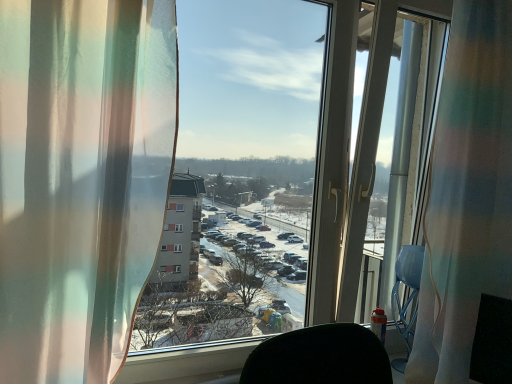
Question: Is there a large distance between translucent fabric curtain at right, which is the second curtain from front to back, and translucent sheer curtain at left, the second curtain viewed from the right?

Choices:
 (A) no
 (B) yes

Answer: (A)

Question: From a real-world perspective, does translucent fabric curtain at right, which is the second curtain from front to back, stand above translucent sheer curtain at left, the second curtain viewed from the right?

Choices:
 (A) yes
 (B) no

Answer: (A)

Question: Considering the relative sizes of translucent fabric curtain at right, positioned as the 2th curtain in left-to-right order, and translucent sheer curtain at left, arranged as the 2th curtain when viewed from the back, in the image provided, is translucent fabric curtain at right, positioned as the 2th curtain in left-to-right order, wider than translucent sheer curtain at left, arranged as the 2th curtain when viewed from the back,?

Choices:
 (A) yes
 (B) no

Answer: (B)

Question: From a real-world perspective, is translucent fabric curtain at right, which ranks as the first curtain in back-to-front order, located beneath translucent sheer curtain at left, the first curtain viewed from the left?

Choices:
 (A) yes
 (B) no

Answer: (B)

Question: Is translucent fabric curtain at right, arranged as the first curtain when viewed from the right, in contact with translucent sheer curtain at left, the second curtain viewed from the right?

Choices:
 (A) no
 (B) yes

Answer: (A)

Question: Is translucent fabric curtain at right, which ranks as the first curtain in back-to-front order, not inside translucent sheer curtain at left, the second curtain viewed from the right?

Choices:
 (A) yes
 (B) no

Answer: (A)

Question: Is translucent sheer curtain at left, the first curtain viewed from the left, at the right side of translucent fabric curtain at right, positioned as the 2th curtain in left-to-right order?

Choices:
 (A) yes
 (B) no

Answer: (B)

Question: Is translucent sheer curtain at left, the second curtain viewed from the right, taller than translucent fabric curtain at right, which is the second curtain from front to back?

Choices:
 (A) no
 (B) yes

Answer: (A)

Question: From the image's perspective, is translucent sheer curtain at left, the second curtain viewed from the right, under translucent fabric curtain at right, arranged as the first curtain when viewed from the right?

Choices:
 (A) yes
 (B) no

Answer: (A)

Question: Is translucent sheer curtain at left, arranged as the 2th curtain when viewed from the back, bigger than translucent fabric curtain at right, which is the second curtain from front to back?

Choices:
 (A) yes
 (B) no

Answer: (B)

Question: Is translucent sheer curtain at left, which is the first curtain from front to back, with translucent fabric curtain at right, positioned as the 2th curtain in left-to-right order?

Choices:
 (A) yes
 (B) no

Answer: (B)

Question: Is translucent fabric curtain at right, arranged as the first curtain when viewed from the right, surrounded by translucent sheer curtain at left, the first curtain viewed from the left?

Choices:
 (A) no
 (B) yes

Answer: (A)

Question: Considering the relative positions of translucent fabric at center and translucent sheer curtain at left, the second curtain viewed from the right, in the image provided, is translucent fabric at center to the left of translucent sheer curtain at left, the second curtain viewed from the right, from the viewer's perspective?

Choices:
 (A) no
 (B) yes

Answer: (A)